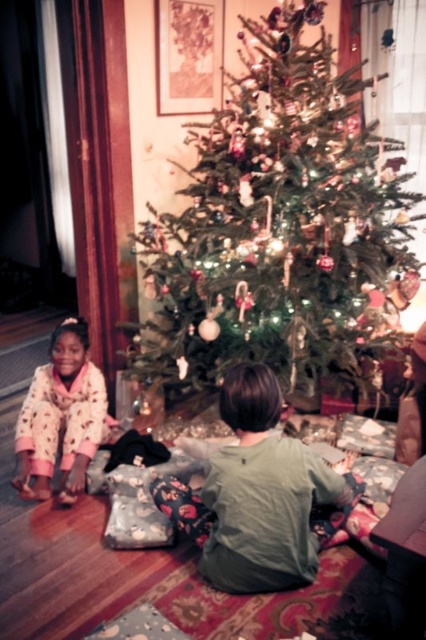
Question: Is green textured christmas tree at center positioned in front of pink fleece pajamas at lower left?

Choices:
 (A) yes
 (B) no

Answer: (A)

Question: Which object appears farthest from the camera in this image?

Choices:
 (A) green cotton shirt at center
 (B) pink fleece pajamas at lower left
 (C) green textured christmas tree at center

Answer: (B)

Question: Which of the following is the farthest from the observer?

Choices:
 (A) pink fleece pajamas at lower left
 (B) green textured christmas tree at center
 (C) green cotton shirt at center

Answer: (A)

Question: Can you confirm if green cotton shirt at center is positioned above pink fleece pajamas at lower left?

Choices:
 (A) no
 (B) yes

Answer: (A)

Question: From the image, what is the correct spatial relationship of green textured christmas tree at center in relation to pink fleece pajamas at lower left?

Choices:
 (A) above
 (B) below

Answer: (A)

Question: Considering the real-world distances, which object is farthest from the green textured christmas tree at center?

Choices:
 (A) green cotton shirt at center
 (B) pink fleece pajamas at lower left

Answer: (A)